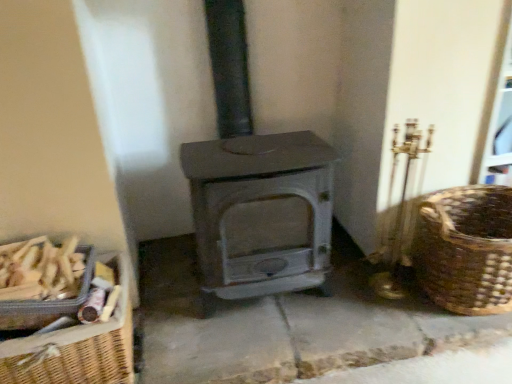
Question: Relative to matte gray wood burning stove at center, is woven brown basket at lower left, which is the 3th basket in right-to-left order, in front or behind?

Choices:
 (A) front
 (B) behind

Answer: (B)

Question: Considering the positions of woven brown basket at lower left, which is the 3th basket in right-to-left order, and matte gray wood burning stove at center in the image, is woven brown basket at lower left, which is the 3th basket in right-to-left order, taller or shorter than matte gray wood burning stove at center?

Choices:
 (A) tall
 (B) short

Answer: (B)

Question: Which object is the farthest from the matte gray wood burning stove at center?

Choices:
 (A) woven wood basket at left, arranged as the 2th basket when viewed from the right
 (B) woven brown basket at lower left, which is the 3th basket in right-to-left order
 (C) brown woven basket at right, placed as the 1th basket when sorted from right to left

Answer: (B)

Question: Which object is positioned closest to the woven wood basket at left, arranged as the 2th basket when viewed from the right?

Choices:
 (A) brown woven basket at right, which is the 3th basket in left-to-right order
 (B) matte gray wood burning stove at center
 (C) woven brown basket at lower left, placed as the 1th basket when sorted from left to right

Answer: (C)